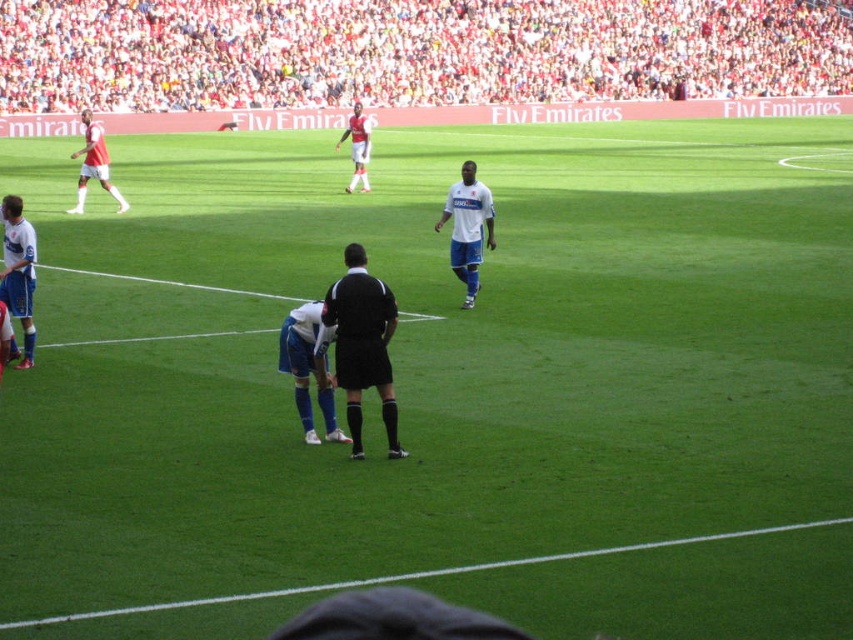
You are a photographer positioned at the edge of the soccer field. You want to capture a photo that includes both the white fabric crowd at upper center and the black matte referee at center. Based on their positions, which object should appear to the right side in your photo?

The white fabric crowd at upper center is positioned to the right of the black matte referee at center, so in the photo, the white fabric crowd at upper center will appear on the right side.